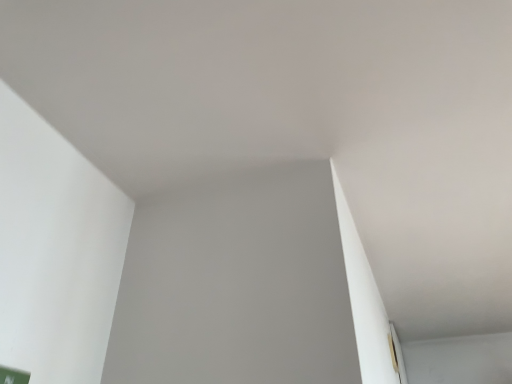
What do you see at coordinates (397, 355) in the screenshot? I see `wooden frame at lower right` at bounding box center [397, 355].

Identify the location of wooden frame at lower right. (397, 355).

The image size is (512, 384). What are the coordinates of `wooden frame at lower right` in the screenshot? It's located at (397, 355).